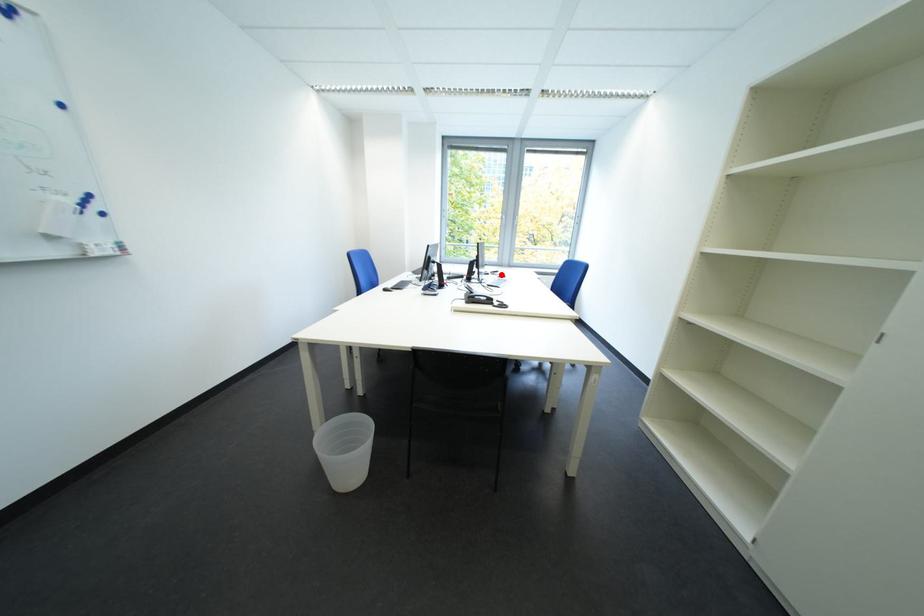
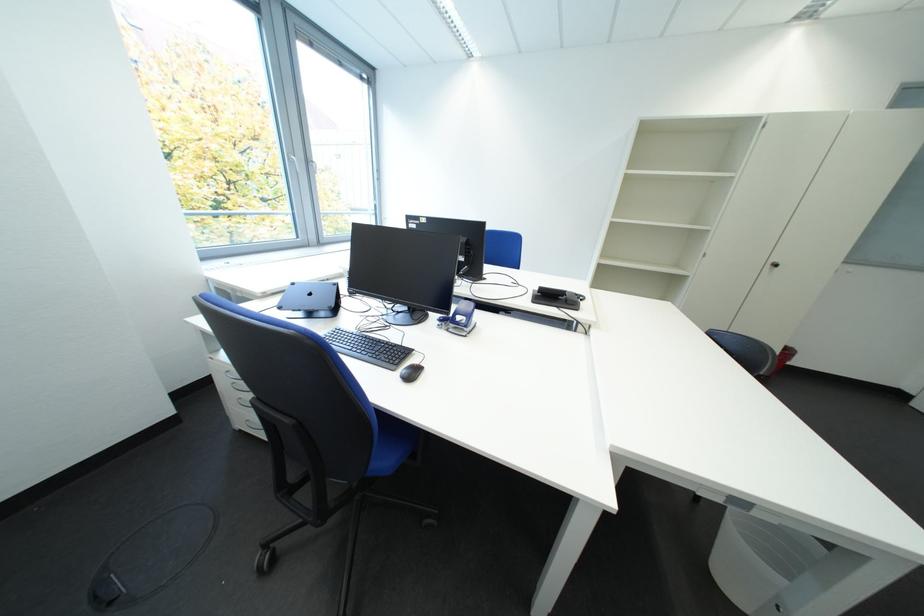
Question: I am providing you with two images of the same scene from different viewpoints. A red point is marked on the first image. Can you still see the location of the red point in image 2?

Choices:
 (A) Yes
 (B) No

Answer: (B)